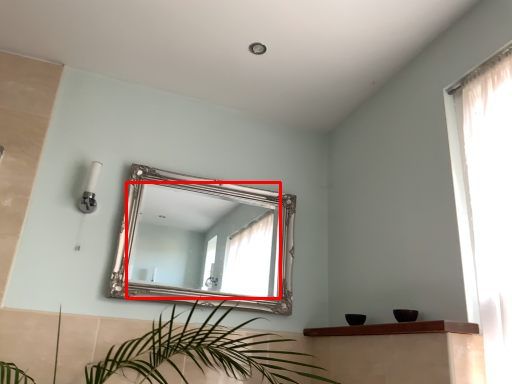
Question: Where is mirror (annotated by the red box) located in relation to balustrade in the image?

Choices:
 (A) right
 (B) left

Answer: (B)